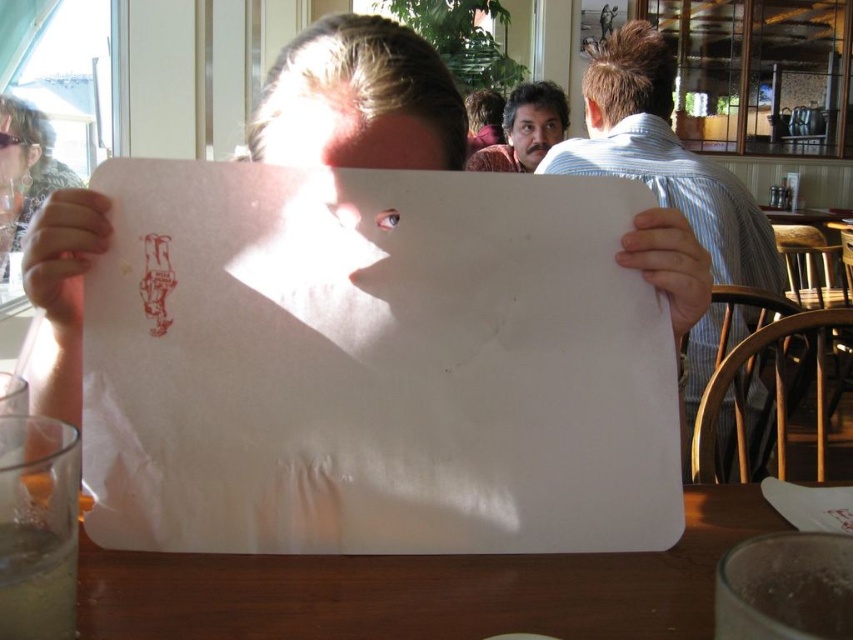
The width and height of the screenshot is (853, 640). Identify the location of white paper at center. [374, 364].

Between point (461, 348) and point (744, 320), which one is positioned behind?

The point (744, 320) is more distant.

At what (x,y) coordinates should I click in order to perform the action: click on white paper at center. Please return your answer as a coordinate pair (x, y). This screenshot has height=640, width=853. Looking at the image, I should click on (374, 364).

Does wooden table at center have a greater height compared to smooth skin face at upper center?

No, wooden table at center is not taller than smooth skin face at upper center.

This screenshot has height=640, width=853. Identify the location of wooden table at center. (422, 588).

Between point (297, 568) and point (538, 152), which one is positioned in front?

Positioned in front is point (297, 568).

Locate an element on the screen. wooden table at center is located at coordinates (422, 588).

Is white paper at center bigger than dark brown hair at upper center?

Incorrect, white paper at center is not larger than dark brown hair at upper center.

Which is in front, point (134, 435) or point (553, 113)?

Point (134, 435) is more forward.

Does point (140, 294) come in front of point (503, 116)?

Yes.

Find the location of a particular element. Image resolution: width=853 pixels, height=640 pixels. white paper at center is located at coordinates (374, 364).